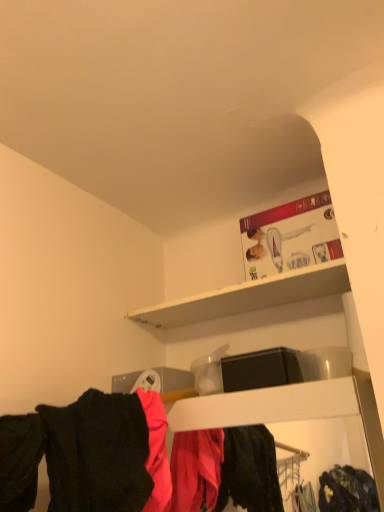
Identify the location of empty space that is ontop of white matte shelf at upper center. The height and width of the screenshot is (512, 384). (243, 298).